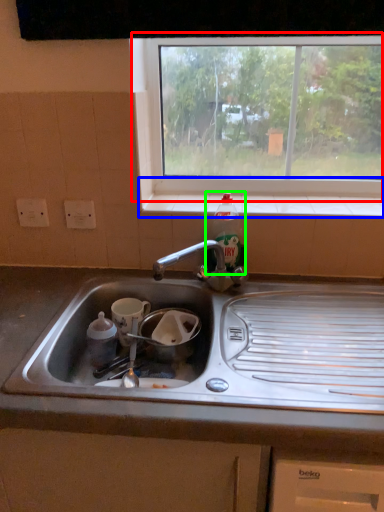
Question: Which object is positioned closest to window (highlighted by a red box)? Select from window sill (highlighted by a blue box) and bottle (highlighted by a green box).

Choices:
 (A) window sill
 (B) bottle

Answer: (A)